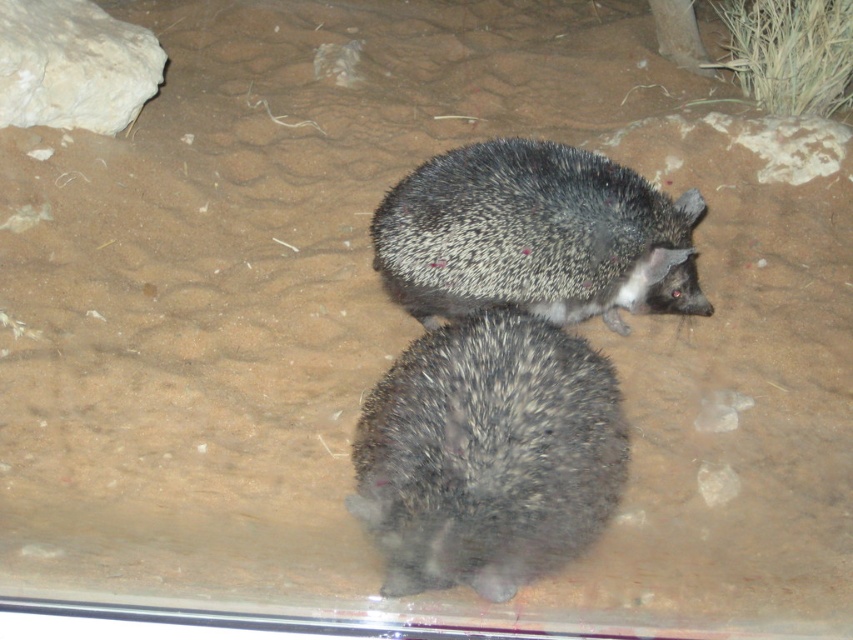
Where is `dark gray spiny hedgehog at center`? This screenshot has height=640, width=853. dark gray spiny hedgehog at center is located at coordinates click(x=488, y=456).

Is spiny black hedgehog at center behind white rough rock at upper left?

That is False.

Is point (682, 292) farther from camera compared to point (13, 17)?

No, (682, 292) is closer to viewer.

Describe the element at coordinates (535, 236) in the screenshot. I see `spiny black hedgehog at center` at that location.

In order to click on spiny black hedgehog at center in this screenshot , I will do pyautogui.click(x=535, y=236).

Can you confirm if dark gray spiny hedgehog at center is positioned above white rough rock at upper left?

No.

Between dark gray spiny hedgehog at center and white rough rock at upper left, which one is positioned higher?

white rough rock at upper left is higher up.

Identify the location of dark gray spiny hedgehog at center. The height and width of the screenshot is (640, 853). (488, 456).

What are the coordinates of `dark gray spiny hedgehog at center` in the screenshot? It's located at (488, 456).